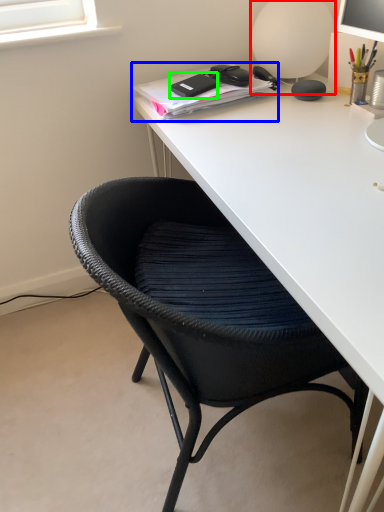
Question: Considering the real-world distances, which object is farthest from table lamp (highlighted by a red box)? notebook (highlighted by a blue box) or stationery (highlighted by a green box)?

Choices:
 (A) notebook
 (B) stationery

Answer: (B)